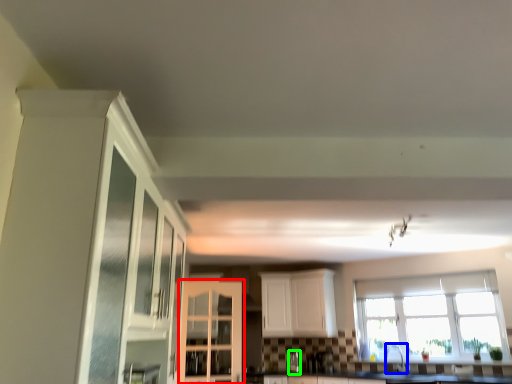
Question: Considering the real-world distances, which object is farthest from cabinetry (highlighted by a red box)? faucet (highlighted by a blue box) or silver (highlighted by a green box)?

Choices:
 (A) faucet
 (B) silver

Answer: (A)